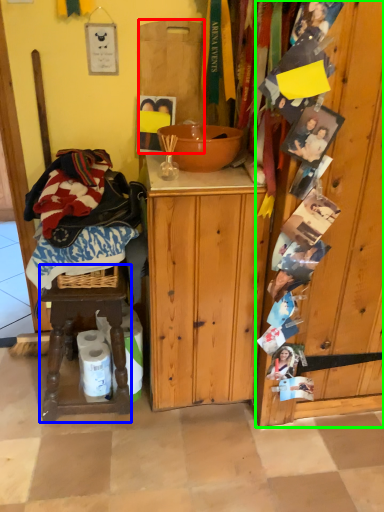
Question: Considering the real-world distances, which object is closest to cutting board (highlighted by a red box)? stool (highlighted by a blue box) or barn door (highlighted by a green box).

Choices:
 (A) stool
 (B) barn door

Answer: (B)